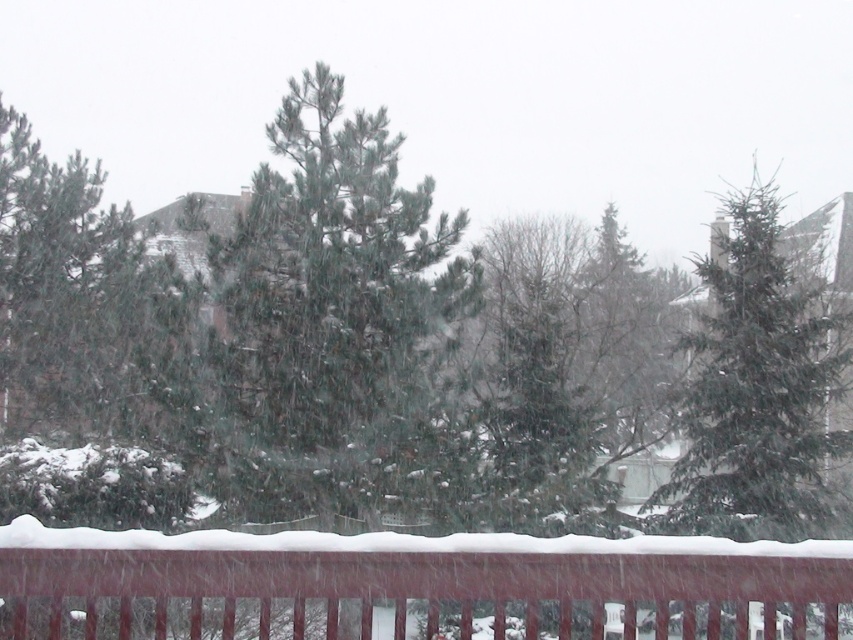
From the picture: Is green needle-like at center closer to camera compared to smooth wooden fence at bottom?

No, it is behind smooth wooden fence at bottom.

Between green needle-like at center and smooth wooden fence at bottom, which one has more height?

green needle-like at center is taller.

Does point (277, 488) come farther from viewer compared to point (234, 634)?

Yes, it is.

I want to click on green needle-like at center, so click(x=329, y=316).

Based on the photo, which is above, green needle-like at center or green needle-like at upper right?

green needle-like at upper right

In the scene shown: Does green needle-like at center lie behind green needle-like at upper right?

Yes, it is.

Find the location of `green needle-like at center`. green needle-like at center is located at coordinates (329, 316).

Does smooth wooden fence at bottom have a lesser height compared to green needle-like at upper right?

Indeed, smooth wooden fence at bottom has a lesser height compared to green needle-like at upper right.

Between point (289, 582) and point (767, 432), which one is positioned behind?

Positioned behind is point (767, 432).

You are a GUI agent. You are given a task and a screenshot of the screen. Output one action in this format:
    pyautogui.click(x=<x>, y=<y>)
    Task: Click on the smooth wooden fence at bottom
    
    Given the screenshot: What is the action you would take?
    pyautogui.click(x=422, y=586)